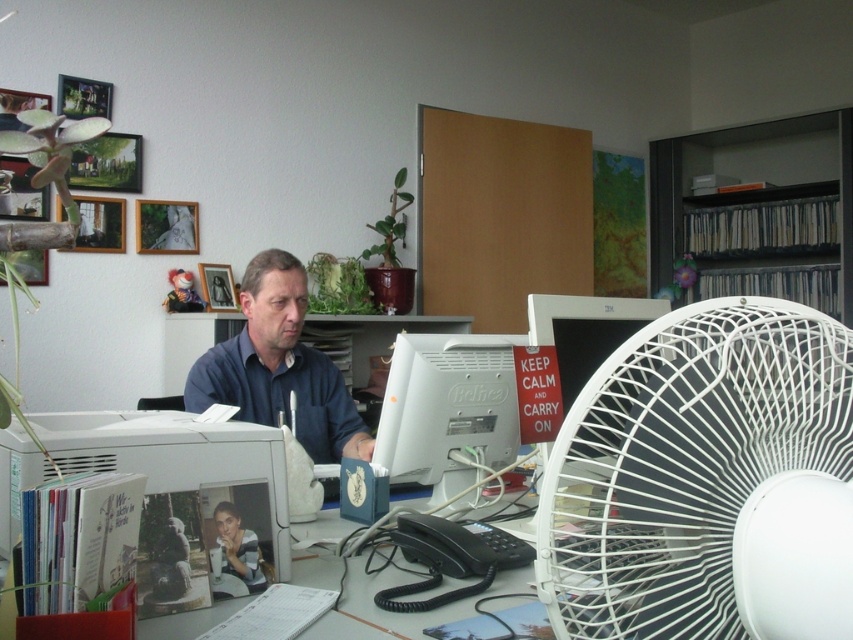
Between white plastic fan at right and white glossy monitor at center right, which one is positioned lower?

white plastic fan at right is below.

How much distance is there between white plastic fan at right and white glossy monitor at center right?

The distance of white plastic fan at right from white glossy monitor at center right is 17.59 inches.

The image size is (853, 640). Describe the element at coordinates (705, 481) in the screenshot. I see `white plastic fan at right` at that location.

The image size is (853, 640). Find the location of `white plastic fan at right`. white plastic fan at right is located at coordinates (705, 481).

Locate an element on the screen. The width and height of the screenshot is (853, 640). white plastic fan at right is located at coordinates (705, 481).

Which is more to the left, white plastic fan at right or dark blue shirt at center?

Positioned to the left is dark blue shirt at center.

The height and width of the screenshot is (640, 853). What do you see at coordinates (705, 481) in the screenshot? I see `white plastic fan at right` at bounding box center [705, 481].

This screenshot has width=853, height=640. I want to click on white plastic fan at right, so click(x=705, y=481).

Is point (393, 470) farther from viewer compared to point (566, 348)?

That is True.

Can you confirm if white plastic monitor at center is positioned below white glossy monitor at center right?

Yes.

Find the location of a particular element. This screenshot has height=640, width=853. white plastic monitor at center is located at coordinates (448, 410).

This screenshot has width=853, height=640. In order to click on white plastic monitor at center in this screenshot , I will do `click(448, 410)`.